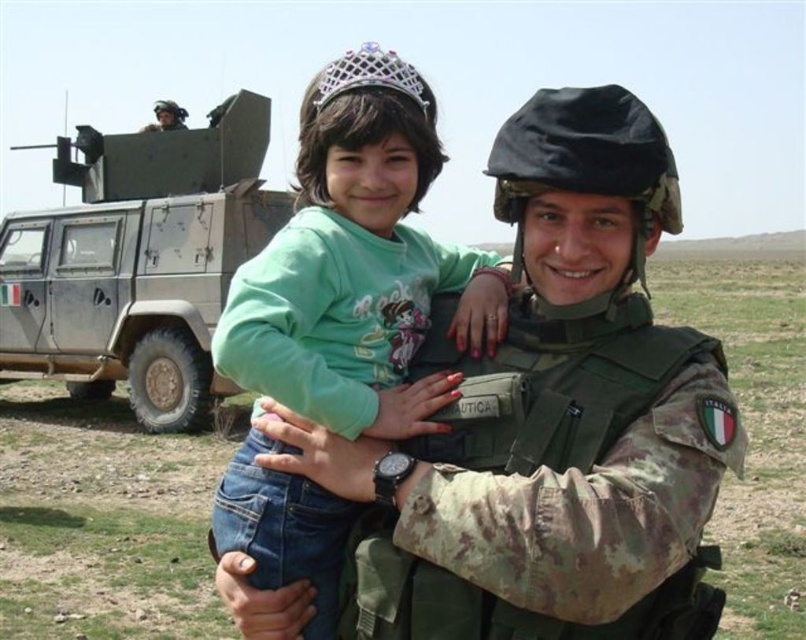
Based on the scene description, which object is larger in size between the green matte shirt at center and the camouflage military vehicle at upper left?

The green matte shirt at center is larger in size compared to the camouflage military vehicle at upper left according to the description.

You are standing in the desert scene and want to place a small flag exactly halfway between point (123,349) and point (165,100). Will the flag be closer to the front or the back of the image?

The flag placed halfway between point (123,349) and point (165,100) will be closer to the front of the image because point (123,349) is closer to the viewer than point (165,100).